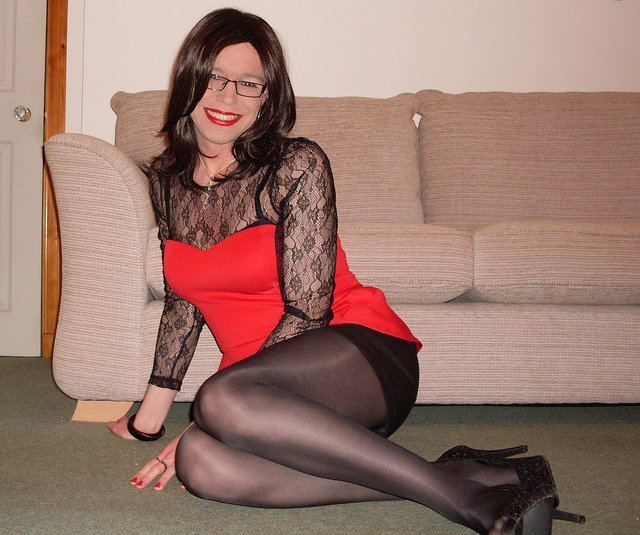
I want to click on floor, so click(84, 498).